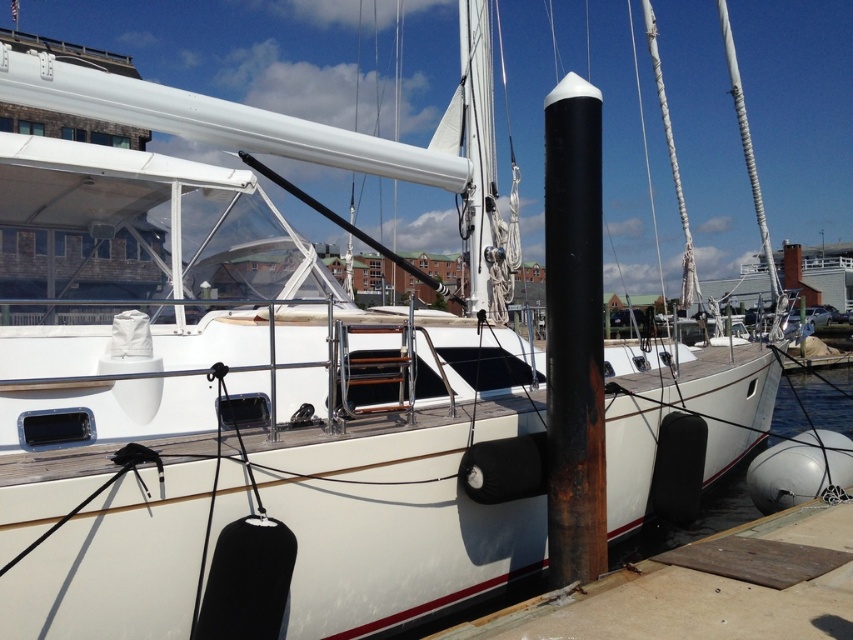
Question: Is wooden at lower right wider than rusty metal pole at center?

Choices:
 (A) yes
 (B) no

Answer: (A)

Question: Does wooden at lower right have a greater width compared to rusty metal pole at center?

Choices:
 (A) yes
 (B) no

Answer: (A)

Question: Which of the following is the closest to the observer?

Choices:
 (A) wooden at lower right
 (B) rusty metal pole at center

Answer: (A)

Question: Does wooden at lower right appear over rusty metal pole at center?

Choices:
 (A) no
 (B) yes

Answer: (A)

Question: Which of the following is the closest to the observer?

Choices:
 (A) (590, 323)
 (B) (635, 580)

Answer: (B)

Question: Which point is closer to the camera?

Choices:
 (A) wooden at lower right
 (B) rusty metal pole at center

Answer: (A)